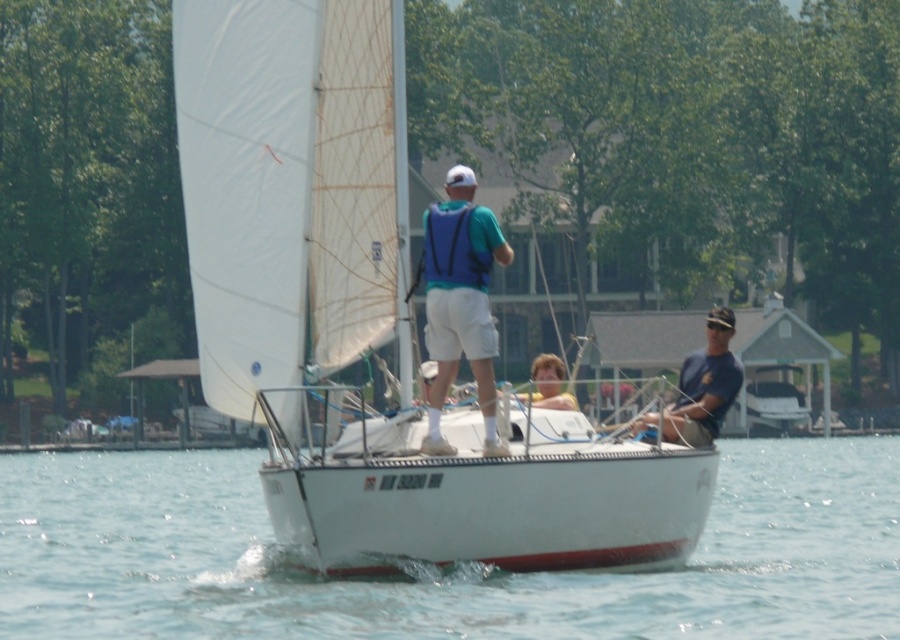
You are a photographer trying to capture the white matte sailboat at center from the shore. Since the clear blue water at center is behind the sailboat, will you be able to see the sailboat clearly through the water?

The clear blue water at center is behind the white matte sailboat at center, so the photographer will be able to see the sailboat clearly as the water is clear and positioned behind it, allowing for an unobstructed view.

You are a passenger on the sailboat and want to see the clear blue water at center. Which direction should you look relative to the smooth blonde hair at center?

The clear blue water at center is in front of the smooth blonde hair at center, so you should look forward towards the direction the smooth blonde hair at center is facing to see the clear blue water at center.

You are a photographer trying to capture a clear photo of the two people in the center of the sailboat. Since both the matte blue vest at center and the blue fabric shirt at center are blue, how can you distinguish them in your photo?

The matte blue vest at center has a smaller size compared to the blue fabric shirt at center, so you can distinguish them by noting the size difference between the two blue items.